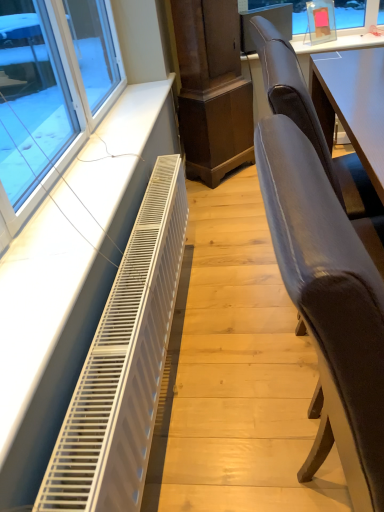
What are the coordinates of `velvet grey chair at right, placed as the second chair when sorted from back to front` in the screenshot? It's located at (329, 304).

In order to face suede-like brown chair at right, the first chair from the back, should I rotate leftwards or rightwards?

A 17.959 degree turn to the right will do.

What do you see at coordinates (124, 362) in the screenshot? I see `white metallic radiator at lower left` at bounding box center [124, 362].

The image size is (384, 512). Identify the location of velvet grey chair at right, positioned as the first chair in front-to-back order. (329, 304).

Does point (289, 70) come behind point (110, 326)?

That is False.

Looking at this image, is suede-like brown chair at right, the first chair from the back, facing towards white metallic radiator at lower left?

No, suede-like brown chair at right, the first chair from the back, does not turn towards white metallic radiator at lower left.

Between suede-like brown chair at right, positioned as the second chair in front-to-back order, and white metallic radiator at lower left, which one has larger width?

With larger width is suede-like brown chair at right, positioned as the second chair in front-to-back order.

Can you confirm if suede-like brown chair at right, the first chair from the back, is bigger than white metallic radiator at lower left?

Yes, suede-like brown chair at right, the first chair from the back, is bigger than white metallic radiator at lower left.

Who is more distant, velvet grey chair at right, positioned as the first chair in front-to-back order, or white metallic radiator at lower left?

Positioned behind is white metallic radiator at lower left.

Which of these two, velvet grey chair at right, positioned as the first chair in front-to-back order, or white metallic radiator at lower left, is thinner?

With smaller width is white metallic radiator at lower left.

Is point (375, 471) closer or farther from the camera than point (132, 388)?

Point (375, 471) is closer to the camera than point (132, 388).

From the image's perspective, which object appears higher, velvet grey chair at right, positioned as the first chair in front-to-back order, or white metallic radiator at lower left?

white metallic radiator at lower left is shown above in the image.

Could you tell me if white metallic radiator at lower left is facing velvet grey chair at right, placed as the second chair when sorted from back to front?

Yes, white metallic radiator at lower left is facing velvet grey chair at right, placed as the second chair when sorted from back to front.

Is the position of white metallic radiator at lower left more distant than that of velvet grey chair at right, positioned as the first chair in front-to-back order?

That is True.

Considering the relative positions of white metallic radiator at lower left and velvet grey chair at right, placed as the second chair when sorted from back to front, in the image provided, is white metallic radiator at lower left to the left of velvet grey chair at right, placed as the second chair when sorted from back to front, from the viewer's perspective?

Yes.

Does white metallic radiator at lower left have a greater height compared to velvet grey chair at right, positioned as the first chair in front-to-back order?

No, white metallic radiator at lower left is not taller than velvet grey chair at right, positioned as the first chair in front-to-back order.

How much distance is there between suede-like brown chair at right, the first chair from the back, and velvet grey chair at right, placed as the second chair when sorted from back to front?

They are 15.04 inches apart.

Are suede-like brown chair at right, positioned as the second chair in front-to-back order, and velvet grey chair at right, placed as the second chair when sorted from back to front, located far from each other?

They are positioned close to each other.

From a real-world perspective, which object stands above the other?

suede-like brown chair at right, positioned as the second chair in front-to-back order, is physically above.

Is suede-like brown chair at right, the first chair from the back, in front of or behind velvet grey chair at right, positioned as the first chair in front-to-back order, in the image?

Clearly, suede-like brown chair at right, the first chair from the back, is behind velvet grey chair at right, positioned as the first chair in front-to-back order.

Does white metallic radiator at lower left have a lesser width compared to suede-like brown chair at right, positioned as the second chair in front-to-back order?

Indeed, white metallic radiator at lower left has a lesser width compared to suede-like brown chair at right, positioned as the second chair in front-to-back order.

Is point (124, 358) behind point (281, 105)?

Yes, it is.

Does white metallic radiator at lower left turn towards suede-like brown chair at right, the first chair from the back?

Yes, white metallic radiator at lower left faces towards suede-like brown chair at right, the first chair from the back.

Which object is more forward, white metallic radiator at lower left or suede-like brown chair at right, positioned as the second chair in front-to-back order?

white metallic radiator at lower left is closer to the camera.

Is velvet grey chair at right, positioned as the first chair in front-to-back order, in contact with suede-like brown chair at right, the first chair from the back?

velvet grey chair at right, positioned as the first chair in front-to-back order, and suede-like brown chair at right, the first chair from the back, are clearly separated.

Consider the image. From their relative heights in the image, would you say velvet grey chair at right, placed as the second chair when sorted from back to front, is taller or shorter than suede-like brown chair at right, positioned as the second chair in front-to-back order?

Clearly, velvet grey chair at right, placed as the second chair when sorted from back to front, is taller compared to suede-like brown chair at right, positioned as the second chair in front-to-back order.

Considering the relative sizes of velvet grey chair at right, placed as the second chair when sorted from back to front, and suede-like brown chair at right, positioned as the second chair in front-to-back order, in the image provided, is velvet grey chair at right, placed as the second chair when sorted from back to front, bigger than suede-like brown chair at right, positioned as the second chair in front-to-back order,?

Incorrect, velvet grey chair at right, placed as the second chair when sorted from back to front, is not larger than suede-like brown chair at right, positioned as the second chair in front-to-back order.

From the image's perspective, which one is positioned higher, velvet grey chair at right, positioned as the first chair in front-to-back order, or suede-like brown chair at right, positioned as the second chair in front-to-back order?

suede-like brown chair at right, positioned as the second chair in front-to-back order.

At what (x,y) coordinates should I click in order to perform the action: click on air conditioning below the suede-like brown chair at right, positioned as the second chair in front-to-back order (from the image's perspective). Please return your answer as a coordinate pair (x, y). Image resolution: width=384 pixels, height=512 pixels. Looking at the image, I should click on (124, 362).

At what (x,y) coordinates should I click in order to perform the action: click on chair that is in front of the white metallic radiator at lower left. Please return your answer as a coordinate pair (x, y). The width and height of the screenshot is (384, 512). Looking at the image, I should click on (329, 304).

Based on their spatial positions, is velvet grey chair at right, positioned as the first chair in front-to-back order, or white metallic radiator at lower left further from suede-like brown chair at right, positioned as the second chair in front-to-back order?

white metallic radiator at lower left is further to suede-like brown chair at right, positioned as the second chair in front-to-back order.

When comparing their distances from velvet grey chair at right, positioned as the first chair in front-to-back order, does suede-like brown chair at right, the first chair from the back, or white metallic radiator at lower left seem closer?

suede-like brown chair at right, the first chair from the back, is positioned closer to the anchor velvet grey chair at right, positioned as the first chair in front-to-back order.

Based on their spatial positions, is white metallic radiator at lower left or suede-like brown chair at right, the first chair from the back, further from velvet grey chair at right, positioned as the first chair in front-to-back order?

The object further to velvet grey chair at right, positioned as the first chair in front-to-back order, is white metallic radiator at lower left.

Looking at the image, which one is located further to white metallic radiator at lower left, velvet grey chair at right, positioned as the first chair in front-to-back order, or suede-like brown chair at right, positioned as the second chair in front-to-back order?

suede-like brown chair at right, positioned as the second chair in front-to-back order, is further to white metallic radiator at lower left.

When comparing their distances from white metallic radiator at lower left, does suede-like brown chair at right, the first chair from the back, or velvet grey chair at right, positioned as the first chair in front-to-back order, seem further?

suede-like brown chair at right, the first chair from the back, is positioned further to the anchor white metallic radiator at lower left.

When comparing their distances from suede-like brown chair at right, positioned as the second chair in front-to-back order, does white metallic radiator at lower left or velvet grey chair at right, placed as the second chair when sorted from back to front, seem further?

white metallic radiator at lower left is positioned further to the anchor suede-like brown chair at right, positioned as the second chair in front-to-back order.

Where is `air conditioning between velvet grey chair at right, placed as the second chair when sorted from back to front, and suede-like brown chair at right, positioned as the second chair in front-to-back order, in the front-back direction`? The height and width of the screenshot is (512, 384). air conditioning between velvet grey chair at right, placed as the second chair when sorted from back to front, and suede-like brown chair at right, positioned as the second chair in front-to-back order, in the front-back direction is located at coordinates (124, 362).